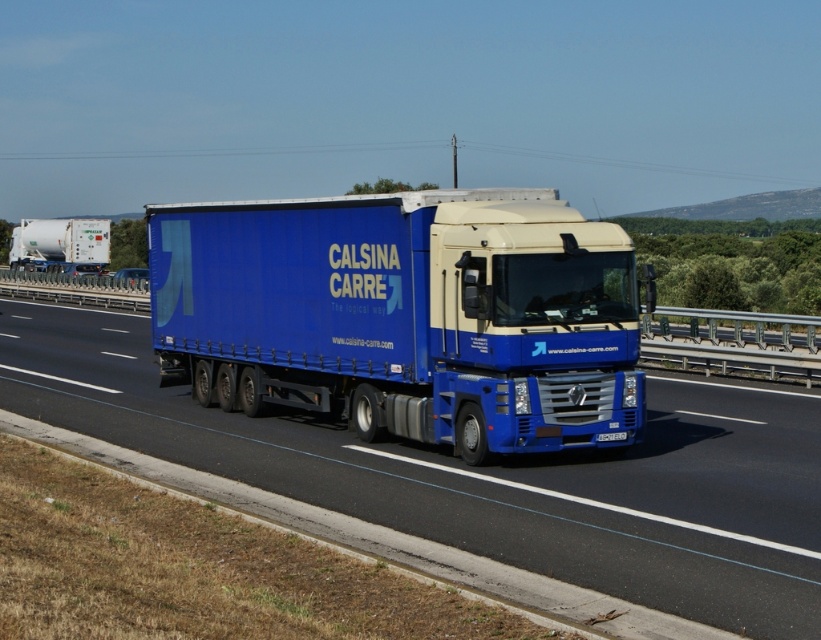
Question: Does blue matte trailer truck at center have a greater width compared to blue metallic truck at center?

Choices:
 (A) yes
 (B) no

Answer: (B)

Question: Which point is closer to the camera?

Choices:
 (A) white plastic license plate at center
 (B) blue matte trailer truck at center
 (C) white matte tank at left
 (D) blue metallic truck at center

Answer: (D)

Question: Can you confirm if blue metallic truck at center is positioned to the left of white matte tank at left?

Choices:
 (A) yes
 (B) no

Answer: (B)

Question: Which object is positioned farthest from the blue matte trailer truck at center?

Choices:
 (A) white matte tank at left
 (B) white plastic license plate at center
 (C) blue metallic truck at center

Answer: (A)

Question: Can you confirm if blue matte trailer truck at center is thinner than blue metallic truck at center?

Choices:
 (A) yes
 (B) no

Answer: (A)

Question: Which of the following is the closest to the observer?

Choices:
 (A) white plastic license plate at center
 (B) blue matte trailer truck at center
 (C) blue metallic truck at center

Answer: (C)